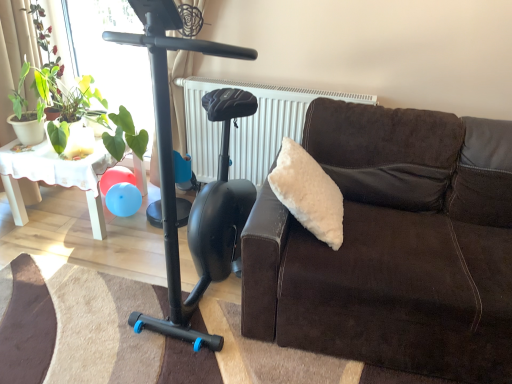
This screenshot has height=384, width=512. What are the coordinates of `unoccupied area in front of white lace table at left` in the screenshot? It's located at (59, 255).